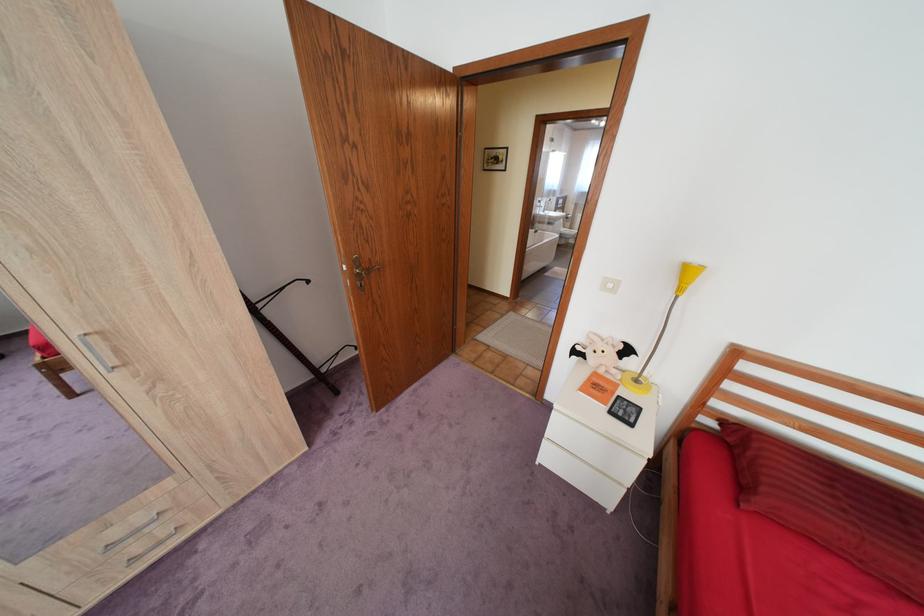
Where would you press the white light switch? Please return your answer as a coordinate pair (x, y).

(610, 285)